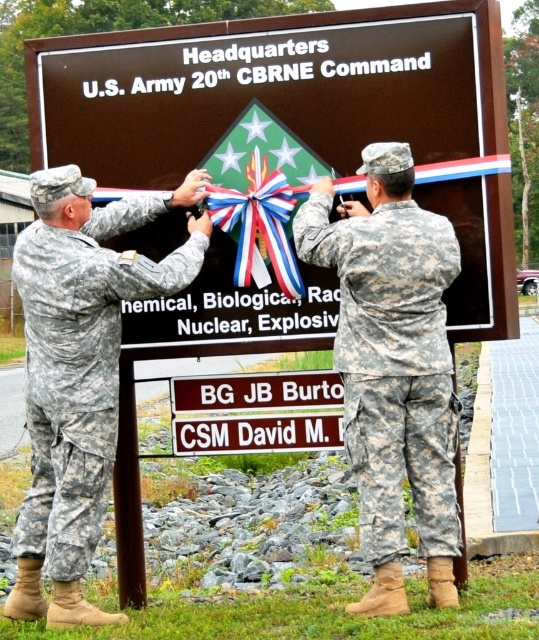
Question: Which point is farther to the camera?

Choices:
 (A) (255, 262)
 (B) (224, 330)
 (C) (190, 234)

Answer: (B)

Question: Is brown matte sign at center above shiny metallic ribbon at center?

Choices:
 (A) yes
 (B) no

Answer: (A)

Question: Does brown matte sign at center appear on the left side of camouflage uniform at left?

Choices:
 (A) yes
 (B) no

Answer: (B)

Question: Which object is the farthest from the camouflage uniform at left?

Choices:
 (A) camouflage fabric uniform at center
 (B) shiny metallic ribbon at center
 (C) brown matte sign at center

Answer: (A)

Question: Is camouflage fabric uniform at center above shiny metallic ribbon at center?

Choices:
 (A) no
 (B) yes

Answer: (A)

Question: Which object is farther from the camera taking this photo?

Choices:
 (A) shiny metallic ribbon at center
 (B) camouflage fabric uniform at center
 (C) brown matte sign at center

Answer: (A)